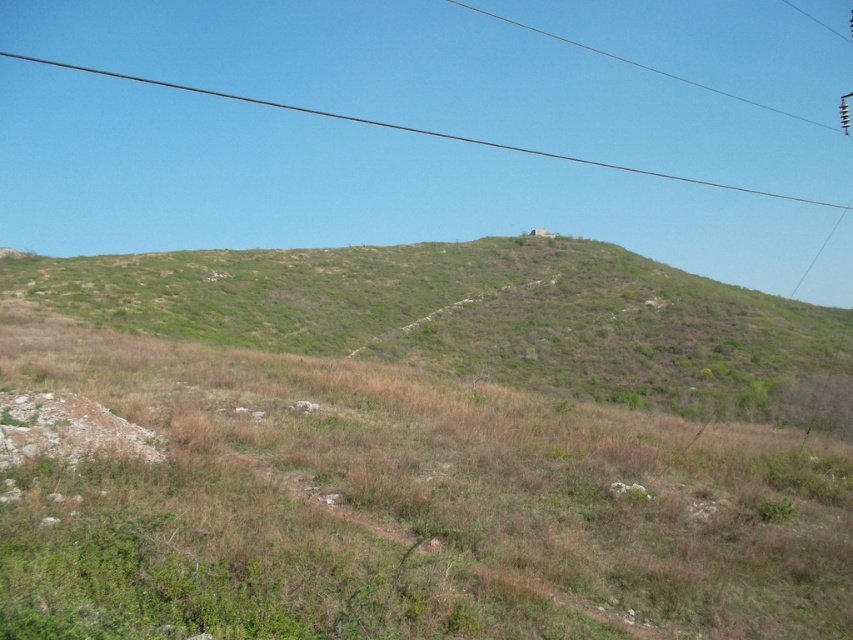
Between green grassy hillside at upper center and black wire at upper center, which one appears on the left side from the viewer's perspective?

Positioned to the left is black wire at upper center.

Which is in front, point (845, 360) or point (637, 170)?

Point (845, 360) is in front.

The image size is (853, 640). I want to click on green grassy hillside at upper center, so click(x=485, y=317).

Does green grassy hillside at center appear on the right side of green grassy hillside at upper center?

No, green grassy hillside at center is not to the right of green grassy hillside at upper center.

Is green grassy hillside at center positioned before green grassy hillside at upper center?

That is True.

Where is `green grassy hillside at center`? The height and width of the screenshot is (640, 853). green grassy hillside at center is located at coordinates (404, 508).

The image size is (853, 640). Identify the location of green grassy hillside at center. point(404,508).

Does point (782, 552) lie behind point (250, 99)?

No, it is not.

Is green grassy hillside at center to the right of black wire at upper center from the viewer's perspective?

Incorrect, green grassy hillside at center is not on the right side of black wire at upper center.

The width and height of the screenshot is (853, 640). Describe the element at coordinates (404, 508) in the screenshot. I see `green grassy hillside at center` at that location.

Locate an element on the screen. This screenshot has height=640, width=853. green grassy hillside at center is located at coordinates (404, 508).